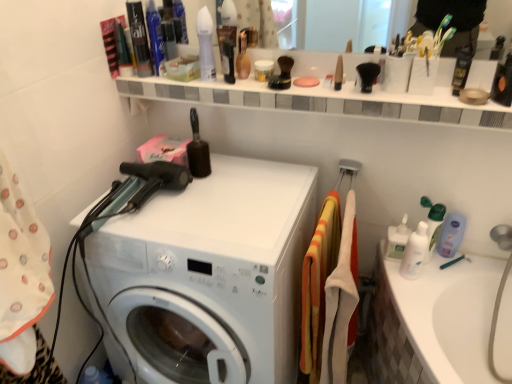
Question: Does white glossy lotion at right, which is the sixth toiletry from left to right, come in front of shiny blue bottle at upper left, the 2th toiletry positioned from the left?

Choices:
 (A) yes
 (B) no

Answer: (A)

Question: From the image's perspective, would you say white glossy lotion at right, marked as the second toiletry in a right-to-left arrangement, is positioned over shiny blue bottle at upper left, marked as the first toiletry in a top-to-bottom arrangement?

Choices:
 (A) yes
 (B) no

Answer: (B)

Question: Is white glossy lotion at right, marked as the second toiletry in a right-to-left arrangement, positioned far away from shiny blue bottle at upper left, acting as the 7th toiletry starting from the bottom?

Choices:
 (A) no
 (B) yes

Answer: (A)

Question: Is white glossy lotion at right, marked as the second toiletry in a right-to-left arrangement, in contact with shiny blue bottle at upper left, the 2th toiletry positioned from the left?

Choices:
 (A) no
 (B) yes

Answer: (A)

Question: Is white glossy lotion at right, which is the sixth toiletry from left to right, at the left side of shiny blue bottle at upper left, the 2th toiletry positioned from the left?

Choices:
 (A) no
 (B) yes

Answer: (A)

Question: Is white glossy lotion at right, which is the sixth toiletry from left to right, thinner than shiny blue bottle at upper left, which is the 6th toiletry in right-to-left order?

Choices:
 (A) no
 (B) yes

Answer: (A)

Question: From the image's perspective, is clear plastic bottle at right, placed as the second cleaning product when sorted from left to right, over white glossy lotion at right, which ranks as the 7th toiletry in top-to-bottom order?

Choices:
 (A) yes
 (B) no

Answer: (A)

Question: Is there a large distance between clear plastic bottle at right, placed as the second cleaning product when sorted from left to right, and white glossy lotion at right, which is the sixth toiletry from left to right?

Choices:
 (A) yes
 (B) no

Answer: (B)

Question: Is clear plastic bottle at right, placed as the second cleaning product when sorted from left to right, completely or partially outside of white glossy lotion at right, marked as the second toiletry in a right-to-left arrangement?

Choices:
 (A) no
 (B) yes

Answer: (B)

Question: Considering the relative positions of clear plastic bottle at right, which appears as the 1th cleaning product when viewed from the right, and white glossy lotion at right, which ranks as the first toiletry in bottom-to-top order, in the image provided, is clear plastic bottle at right, which appears as the 1th cleaning product when viewed from the right, behind white glossy lotion at right, which ranks as the first toiletry in bottom-to-top order,?

Choices:
 (A) no
 (B) yes

Answer: (B)

Question: Does clear plastic bottle at right, placed as the second cleaning product when sorted from left to right, have a lesser height compared to white glossy lotion at right, which ranks as the first toiletry in bottom-to-top order?

Choices:
 (A) yes
 (B) no

Answer: (A)

Question: From the image's perspective, is clear plastic bottle at right, placed as the second cleaning product when sorted from left to right, below white glossy lotion at right, marked as the second toiletry in a right-to-left arrangement?

Choices:
 (A) no
 (B) yes

Answer: (A)

Question: Is white matte jar at upper center, which ranks as the 4th toiletry in right-to-left order, not close to orange/yellow striped towel at center, the first material in the left-to-right sequence?

Choices:
 (A) yes
 (B) no

Answer: (B)